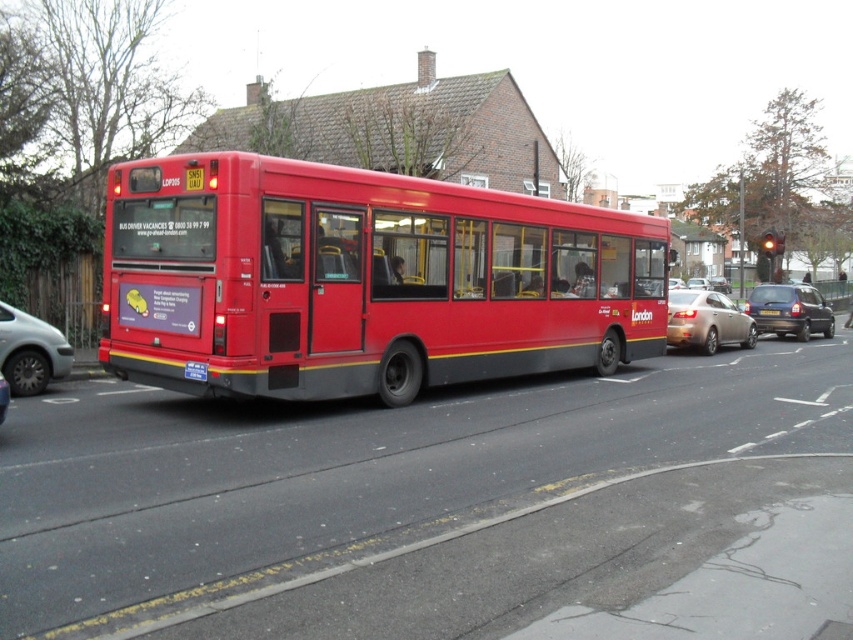
In the scene shown: You are a pedestrian waiting to cross the street. You see the metallic silver car at center and the black plastic license plate at center. Which object is closer to you?

The metallic silver car at center is closer to you because it is in front of the black plastic license plate at center.

You are standing on the sidewalk next to the road where the metallic silver sedan at center is driving. You want to cross the road to the park on the other side. If the sedan is moving at 20 km per hour, how much time do you have to safely cross the road before it reaches your current position?

The metallic silver sedan at center is 16.36 meters away from you. At 20 km per hour, it would take approximately 2.96 seconds to reach your position. You should wait for the sedan to pass before crossing the road safely.

You are a delivery driver who needs to park your truck behind the silver metallic van at left and the black plastic license plate at center. Which one should you park behind to have enough space for your truck?

The silver metallic van at left is bigger than the black plastic license plate at center, so you should park behind the silver metallic van at left to have enough space for your truck.